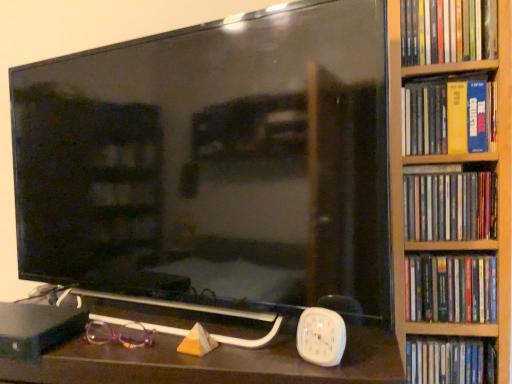
This screenshot has height=384, width=512. In order to click on hardcover book at right, the fourth book when ordered from top to bottom in this screenshot , I will do 451,288.

Image resolution: width=512 pixels, height=384 pixels. I want to click on matte plastic book at right, which is the 1th book from top to bottom, so click(x=447, y=31).

Identify the location of white plastic clock at lower right. (321, 337).

Where is `hardcover book at right, the fourth book when ordered from top to bottom`? The image size is (512, 384). hardcover book at right, the fourth book when ordered from top to bottom is located at coordinates (451, 288).

Does white plastic clock at lower right appear on the right side of yellow matte book at right, the 2th book viewed from the top?

Incorrect, white plastic clock at lower right is not on the right side of yellow matte book at right, the 2th book viewed from the top.

Choose the correct answer: Is white plastic clock at lower right inside yellow matte book at right, the 2th book viewed from the top, or outside it?

white plastic clock at lower right is outside yellow matte book at right, the 2th book viewed from the top.

How different are the orientations of white plastic clock at lower right and yellow matte book at right, the 2th book viewed from the top, in degrees?

There is a 16.1-degree angle between the facing directions of white plastic clock at lower right and yellow matte book at right, the 2th book viewed from the top.

Which point is more distant from viewer, (332, 320) or (490, 89)?

Positioned behind is point (490, 89).

From the image's perspective, which one is positioned higher, hardcover book at right, marked as the second book in a bottom-to-top arrangement, or white plastic clock at lower right?

hardcover book at right, marked as the second book in a bottom-to-top arrangement, from the image's perspective.

Locate an element on the screen. clock on the left of the hardcover book at right, marked as the second book in a bottom-to-top arrangement is located at coordinates (321, 337).

From their relative heights in the image, would you say hardcover book at right, the fourth book when ordered from top to bottom, is taller or shorter than white plastic clock at lower right?

Clearly, hardcover book at right, the fourth book when ordered from top to bottom, is taller compared to white plastic clock at lower right.

Is hardcover book at right, marked as the second book in a bottom-to-top arrangement, wider than white plastic clock at lower right?

Indeed, hardcover book at right, marked as the second book in a bottom-to-top arrangement, has a greater width compared to white plastic clock at lower right.

From the image's perspective, is hardcover book at right, marked as the second book in a bottom-to-top arrangement, beneath white plastic dvd case at right, the 1th book when ordered from bottom to top?

No.

Can you tell me how much hardcover book at right, marked as the second book in a bottom-to-top arrangement, and white plastic dvd case at right, the 5th book in the top-to-bottom sequence, differ in facing direction?

The angle between the facing direction of hardcover book at right, marked as the second book in a bottom-to-top arrangement, and the facing direction of white plastic dvd case at right, the 5th book in the top-to-bottom sequence, is 0.00273 degrees.

Which of these two, hardcover book at right, the fourth book when ordered from top to bottom, or white plastic dvd case at right, the 5th book in the top-to-bottom sequence, is bigger?

white plastic dvd case at right, the 5th book in the top-to-bottom sequence, is bigger.

Can white plastic dvd case at right, the 5th book in the top-to-bottom sequence, be found inside hardcover book at right, marked as the second book in a bottom-to-top arrangement?

No, hardcover book at right, marked as the second book in a bottom-to-top arrangement, does not contain white plastic dvd case at right, the 5th book in the top-to-bottom sequence.

Does matte plastic dvds at right, the third book when ordered from top to bottom, come in front of matte plastic book at right, which is the 1th book from top to bottom?

No, matte plastic dvds at right, the third book when ordered from top to bottom, is further to the viewer.

Which is nearer, (456, 221) or (479, 56)?

Positioned in front is point (479, 56).

Are matte plastic dvds at right, the third book when ordered from top to bottom, and matte plastic book at right, the 5th book ordered from the bottom, making contact?

No, matte plastic dvds at right, the third book when ordered from top to bottom, is not beside matte plastic book at right, the 5th book ordered from the bottom.

Is matte plastic dvds at right, the third book when ordered from top to bottom, inside or outside of matte plastic book at right, the 5th book ordered from the bottom?

matte plastic dvds at right, the third book when ordered from top to bottom, is located beyond the bounds of matte plastic book at right, the 5th book ordered from the bottom.

Are white plastic clock at lower right and matte plastic dvds at right, which is the 3th book from bottom to top, far apart?

No, white plastic clock at lower right is in close proximity to matte plastic dvds at right, which is the 3th book from bottom to top.

Does white plastic clock at lower right have a lesser height compared to matte plastic dvds at right, which is the 3th book from bottom to top?

Yes, white plastic clock at lower right is shorter than matte plastic dvds at right, which is the 3th book from bottom to top.

Relative to matte plastic dvds at right, which is the 3th book from bottom to top, is white plastic clock at lower right in front or behind?

Visually, white plastic clock at lower right is located in front of matte plastic dvds at right, which is the 3th book from bottom to top.

Identify the location of clock that appears below the matte plastic dvds at right, the third book when ordered from top to bottom (from a real-world perspective). This screenshot has height=384, width=512. (321, 337).

Based on the photo, which of these two, black glossy tv at center or matte plastic book at right, which is the 1th book from top to bottom, stands taller?

black glossy tv at center is taller.

Who is bigger, black glossy tv at center or matte plastic book at right, which is the 1th book from top to bottom?

Bigger between the two is black glossy tv at center.

Would you say black glossy tv at center is outside matte plastic book at right, which is the 1th book from top to bottom?

That's correct, black glossy tv at center is outside of matte plastic book at right, which is the 1th book from top to bottom.

Locate an element on the screen. The image size is (512, 384). the 1st book counting from the right of the black glossy tv at center is located at coordinates (447, 31).

Which of these two, matte plastic book at right, which is the 1th book from top to bottom, or black glossy tv at center, stands taller?

black glossy tv at center is taller.

The image size is (512, 384). Find the location of `television lying below the matte plastic book at right, which is the 1th book from top to bottom (from the image's perspective)`. television lying below the matte plastic book at right, which is the 1th book from top to bottom (from the image's perspective) is located at coordinates (213, 163).

From a real-world perspective, who is located lower, matte plastic book at right, which is the 1th book from top to bottom, or black glossy tv at center?

In real-world perspective, black glossy tv at center is lower.

Consider the image. Considering the positions of objects matte plastic book at right, which is the 1th book from top to bottom, and black glossy tv at center in the image provided, who is more to the right, matte plastic book at right, which is the 1th book from top to bottom, or black glossy tv at center?

matte plastic book at right, which is the 1th book from top to bottom, is more to the right.

I want to click on clock lying in front of the yellow matte book at right, the 2th book viewed from the top, so click(321, 337).

I want to click on clock below the hardcover book at right, marked as the second book in a bottom-to-top arrangement (from the image's perspective), so click(321, 337).

Looking at the image, which one is located further to black glossy tv at center, hardcover book at right, marked as the second book in a bottom-to-top arrangement, or purple plastic glasses at lower left?

hardcover book at right, marked as the second book in a bottom-to-top arrangement, is further to black glossy tv at center.

Based on their spatial positions, is white plastic clock at lower right or white plastic dvd case at right, the 1th book when ordered from bottom to top, further from black glossy tv at center?

white plastic dvd case at right, the 1th book when ordered from bottom to top, lies further to black glossy tv at center than the other object.

Considering their positions, is yellow matte book at right, acting as the 4th book starting from the bottom, positioned closer to purple plastic glasses at lower left than white plastic clock at lower right?

Based on the image, white plastic clock at lower right appears to be nearer to purple plastic glasses at lower left.

Which object lies nearer to the anchor point white plastic dvd case at right, the 1th book when ordered from bottom to top, yellow matte book at right, the 2th book viewed from the top, or matte plastic book at right, which is the 1th book from top to bottom?

The object closer to white plastic dvd case at right, the 1th book when ordered from bottom to top, is yellow matte book at right, the 2th book viewed from the top.

When comparing their distances from hardcover book at right, the fourth book when ordered from top to bottom, does black glossy tv at center or yellow matte book at right, the 2th book viewed from the top, seem closer?

yellow matte book at right, the 2th book viewed from the top.

Estimate the real-world distances between objects in this image. Which object is closer to hardcover book at right, marked as the second book in a bottom-to-top arrangement, white plastic clock at lower right or black glossy tv at center?

white plastic clock at lower right is closer to hardcover book at right, marked as the second book in a bottom-to-top arrangement.

When comparing their distances from purple plastic glasses at lower left, does black glossy tv at center or yellow matte book at right, acting as the 4th book starting from the bottom, seem closer?

Based on the image, black glossy tv at center appears to be nearer to purple plastic glasses at lower left.

Considering their positions, is white plastic dvd case at right, the 1th book when ordered from bottom to top, positioned closer to matte plastic book at right, which is the 1th book from top to bottom, than hardcover book at right, marked as the second book in a bottom-to-top arrangement?

Based on the image, hardcover book at right, marked as the second book in a bottom-to-top arrangement, appears to be nearer to matte plastic book at right, which is the 1th book from top to bottom.

Locate an element on the screen. The height and width of the screenshot is (384, 512). clock situated between purple plastic glasses at lower left and yellow matte book at right, the 2th book viewed from the top, from left to right is located at coordinates (321, 337).

Locate an element on the screen. The width and height of the screenshot is (512, 384). clock between purple plastic glasses at lower left and hardcover book at right, the fourth book when ordered from top to bottom is located at coordinates (321, 337).

Find the location of a particular element. clock between matte plastic book at right, which is the 1th book from top to bottom, and purple plastic glasses at lower left vertically is located at coordinates (321, 337).

This screenshot has height=384, width=512. Identify the location of television between purple plastic glasses at lower left and matte plastic dvds at right, which is the 3th book from bottom to top, from left to right. (x=213, y=163).